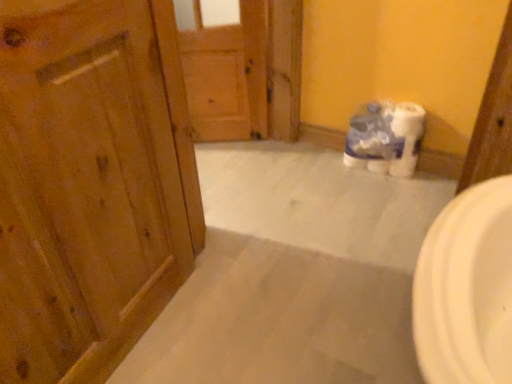
You are a GUI agent. You are given a task and a screenshot of the screen. Output one action in this format:
    pyautogui.click(x=<x>, y=<y>)
    Task: Click on the vacant area to the left of white plastic toilet paper at center
    The width and height of the screenshot is (512, 384).
    Given the screenshot: What is the action you would take?
    pyautogui.click(x=328, y=170)